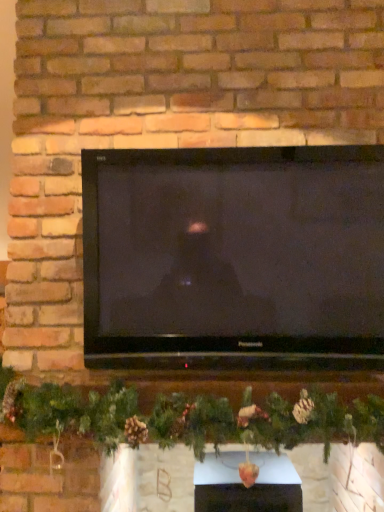
Question: From a real-world perspective, is black glossy tv at center located beneath white glossy fireplace at center?

Choices:
 (A) yes
 (B) no

Answer: (B)

Question: Can you confirm if black glossy tv at center is bigger than white glossy fireplace at center?

Choices:
 (A) no
 (B) yes

Answer: (B)

Question: Could you tell me if black glossy tv at center is turned towards white glossy fireplace at center?

Choices:
 (A) yes
 (B) no

Answer: (B)

Question: Considering the relative positions of black glossy tv at center and white glossy fireplace at center in the image provided, is black glossy tv at center in front of white glossy fireplace at center?

Choices:
 (A) yes
 (B) no

Answer: (A)

Question: Is black glossy tv at center located outside white glossy fireplace at center?

Choices:
 (A) yes
 (B) no

Answer: (A)

Question: Is black glossy tv at center far from white glossy fireplace at center?

Choices:
 (A) yes
 (B) no

Answer: (B)

Question: Is green matte garland at center at the left side of white glossy fireplace at center?

Choices:
 (A) no
 (B) yes

Answer: (B)

Question: Can you confirm if green matte garland at center is thinner than white glossy fireplace at center?

Choices:
 (A) no
 (B) yes

Answer: (A)

Question: Is green matte garland at center outside white glossy fireplace at center?

Choices:
 (A) yes
 (B) no

Answer: (A)

Question: From the image's perspective, is green matte garland at center below white glossy fireplace at center?

Choices:
 (A) no
 (B) yes

Answer: (A)

Question: Is green matte garland at center bigger than white glossy fireplace at center?

Choices:
 (A) no
 (B) yes

Answer: (B)

Question: Can you confirm if green matte garland at center is shorter than white glossy fireplace at center?

Choices:
 (A) yes
 (B) no

Answer: (B)

Question: From a real-world perspective, is white glossy fireplace at center physically below black glossy tv at center?

Choices:
 (A) yes
 (B) no

Answer: (A)